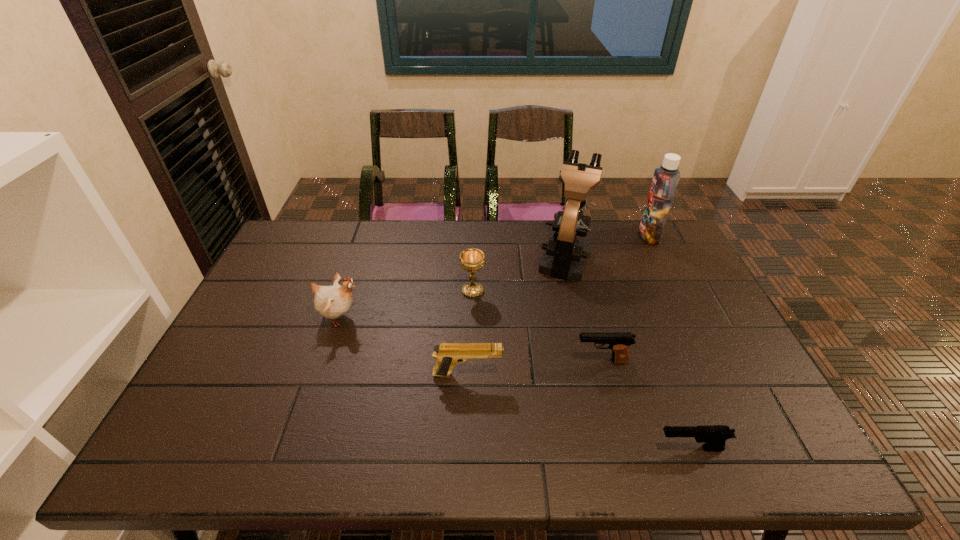
Where is `microscope`? The height and width of the screenshot is (540, 960). microscope is located at coordinates (565, 257).

The height and width of the screenshot is (540, 960). I want to click on shampoo, so click(x=666, y=178).

Where is `the leftmost object`? The height and width of the screenshot is (540, 960). the leftmost object is located at coordinates (331, 302).

I want to click on chalice, so point(472,260).

This screenshot has width=960, height=540. I want to click on the second farthest pistol, so click(x=447, y=354).

At what (x,y) coordinates should I click in order to perform the action: click on the sixth farthest object. Please return your answer as a coordinate pair (x, y). The image size is (960, 540). Looking at the image, I should click on (447, 354).

You are a GUI agent. You are given a task and a screenshot of the screen. Output one action in this format:
    pyautogui.click(x=<x>, y=<y>)
    Task: Click on the third nearest object
    
    Given the screenshot: What is the action you would take?
    pyautogui.click(x=619, y=342)

The image size is (960, 540). In order to click on the second pistol from left to right in this screenshot , I will do `click(619, 342)`.

The image size is (960, 540). Find the location of `the nearest object`. the nearest object is located at coordinates (x=713, y=436).

Identify the location of the rightmost pistol. This screenshot has height=540, width=960. (713, 436).